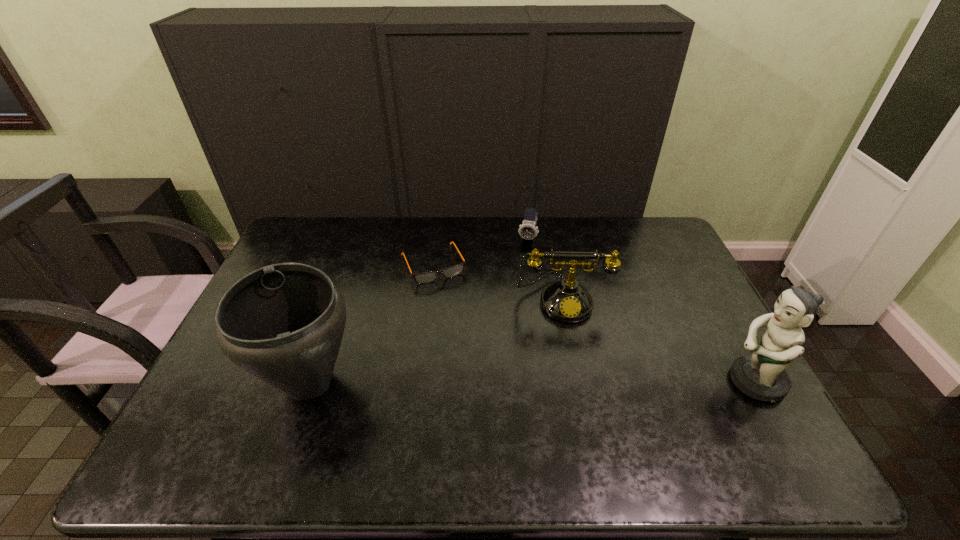
Find the location of a particular element. This screenshot has height=540, width=960. urn is located at coordinates (x=283, y=323).

Find the location of a particular element. The height and width of the screenshot is (540, 960). figurine is located at coordinates (762, 376).

Image resolution: width=960 pixels, height=540 pixels. What are the coordinates of `the second object from left to right` in the screenshot? It's located at (426, 277).

Identify the location of spectacles. The height and width of the screenshot is (540, 960). (426, 277).

Where is `watch`? The image size is (960, 540). watch is located at coordinates (528, 230).

In order to click on the third tallest object in this screenshot , I will do 567,301.

Locate an element on the screen. Image resolution: width=960 pixels, height=540 pixels. vacant space located 0.100m on the back of the leftmost object is located at coordinates (333, 314).

The image size is (960, 540). In order to click on vacant space situated on the front-facing side of the figurine in this screenshot , I will do `click(598, 381)`.

You are a GUI agent. You are given a task and a screenshot of the screen. Output one action in this format:
    pyautogui.click(x=<x>, y=<y>)
    Task: Click on the free space located 0.050m on the front-facing side of the figurine
    This screenshot has height=540, width=960.
    Given the screenshot: What is the action you would take?
    pyautogui.click(x=704, y=381)

Locate an element on the screen. The height and width of the screenshot is (540, 960). blank area located on the front-facing side of the figurine is located at coordinates (681, 381).